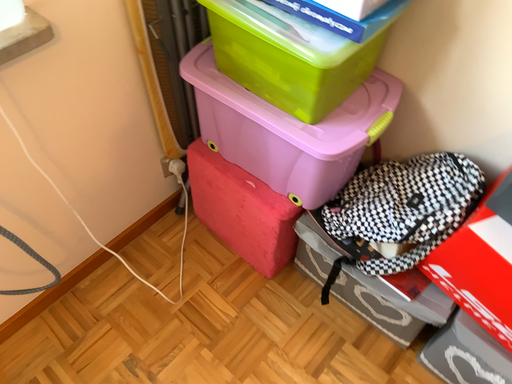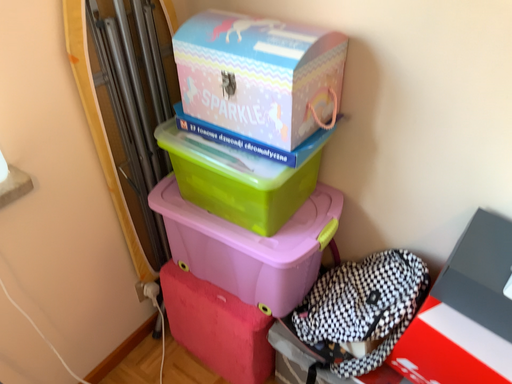
Question: Which way did the camera rotate in the video?

Choices:
 (A) rotated downward
 (B) rotated upward

Answer: (B)